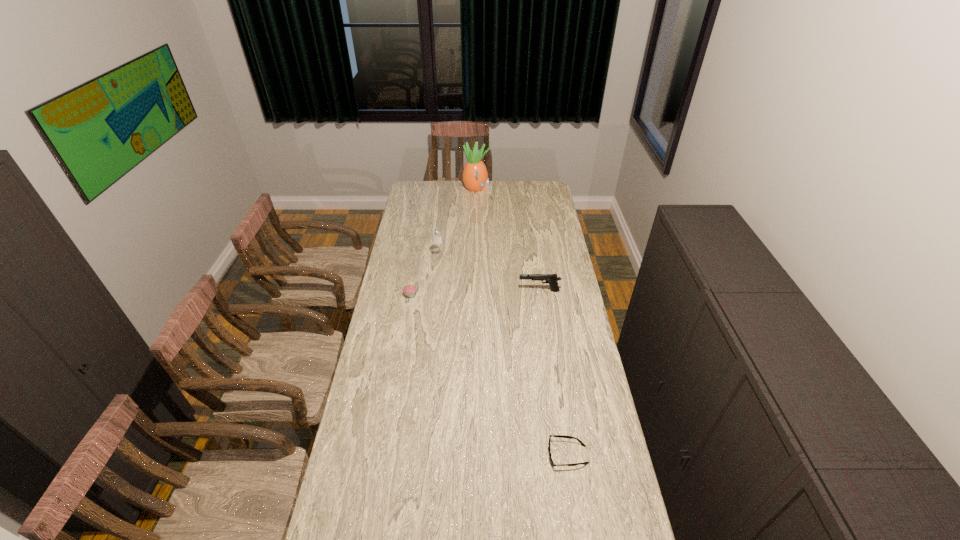
Locate an element on the screen. vacant space located 0.250m on the right of the fourth shortest object is located at coordinates (492, 257).

The height and width of the screenshot is (540, 960). In order to click on vacant space located 0.200m at the aiming end of the gun in this screenshot , I will do [x=476, y=291].

Locate an element on the screen. The width and height of the screenshot is (960, 540). free location located at the aiming end of the gun is located at coordinates (501, 291).

I want to click on vacant space located at the aiming end of the gun, so click(x=501, y=291).

This screenshot has width=960, height=540. What are the coordinates of `vacant space located on the front of the cupcake` in the screenshot? It's located at (401, 351).

The width and height of the screenshot is (960, 540). In order to click on free space located 0.100m on the front-facing side of the shortest object in this screenshot , I will do `click(518, 455)`.

This screenshot has height=540, width=960. Identify the location of free space located 0.050m on the front-facing side of the shortest object. (533, 455).

Where is `blank space located on the front-facing side of the shortest object`? Image resolution: width=960 pixels, height=540 pixels. blank space located on the front-facing side of the shortest object is located at coordinates (434, 455).

Identify the location of object present at the far edge. The height and width of the screenshot is (540, 960). (475, 176).

The height and width of the screenshot is (540, 960). In order to click on object at the left edge in this screenshot , I will do `click(409, 290)`.